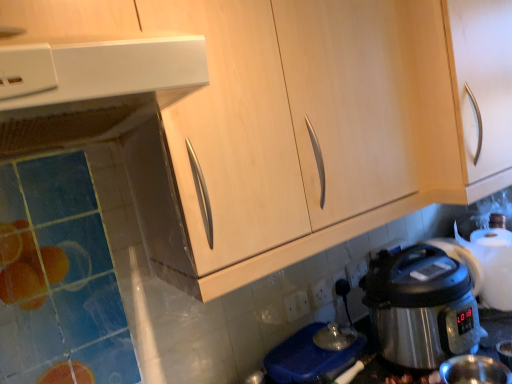
Question: Is shiny metallic coffee cup at lower right wider than light wood cabinet at upper right?

Choices:
 (A) yes
 (B) no

Answer: (B)

Question: Is shiny metallic coffee cup at lower right closer to camera compared to light wood cabinet at upper right?

Choices:
 (A) no
 (B) yes

Answer: (B)

Question: Would you say shiny metallic coffee cup at lower right is outside light wood cabinet at upper right?

Choices:
 (A) yes
 (B) no

Answer: (A)

Question: Is shiny metallic coffee cup at lower right with light wood cabinet at upper right?

Choices:
 (A) yes
 (B) no

Answer: (B)

Question: Is shiny metallic coffee cup at lower right at the left side of light wood cabinet at upper right?

Choices:
 (A) yes
 (B) no

Answer: (A)

Question: Considering the positions of point (306, 309) and point (284, 14), is point (306, 309) closer or farther from the camera than point (284, 14)?

Choices:
 (A) closer
 (B) farther

Answer: (B)

Question: Would you say white plastic power outlet at lower center is inside or outside light wood cabinet at upper right?

Choices:
 (A) inside
 (B) outside

Answer: (B)

Question: From a real-world perspective, relative to light wood cabinet at upper right, is white plastic power outlet at lower center vertically above or below?

Choices:
 (A) above
 (B) below

Answer: (B)

Question: Is white plastic power outlet at lower center bigger or smaller than light wood cabinet at upper right?

Choices:
 (A) big
 (B) small

Answer: (B)

Question: Is point (387, 347) closer or farther from the camera than point (330, 281)?

Choices:
 (A) farther
 (B) closer

Answer: (B)

Question: In the image, is stainless steel rice cooker at lower right positioned in front of or behind white plastic electric outlet at lower center, positioned as the first electric outlet in left-to-right order?

Choices:
 (A) front
 (B) behind

Answer: (A)

Question: In terms of width, does stainless steel rice cooker at lower right look wider or thinner when compared to white plastic electric outlet at lower center, arranged as the 2th electric outlet when viewed from the right?

Choices:
 (A) thin
 (B) wide

Answer: (B)

Question: From a real-world perspective, relative to white plastic electric outlet at lower center, arranged as the 2th electric outlet when viewed from the right, is stainless steel rice cooker at lower right vertically above or below?

Choices:
 (A) below
 (B) above

Answer: (B)

Question: Choose the correct answer: Is light wood cabinet at upper right inside white plastic power plugs and sockets at lower center or outside it?

Choices:
 (A) inside
 (B) outside

Answer: (B)

Question: From a real-world perspective, is light wood cabinet at upper right physically located above or below white plastic power plugs and sockets at lower center?

Choices:
 (A) below
 (B) above

Answer: (B)